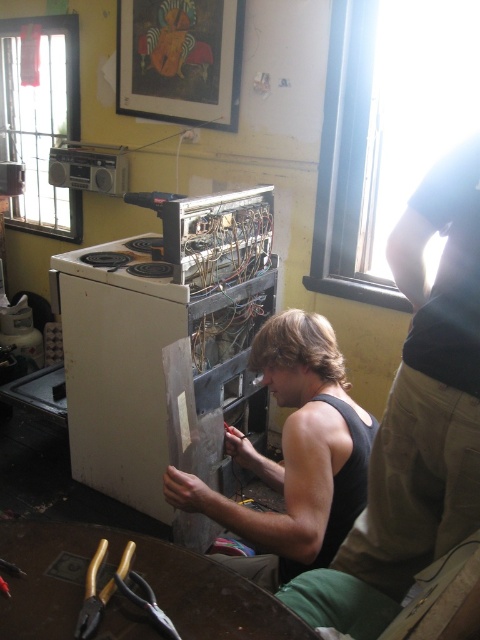
Question: Among these points, which one is nearest to the camera?

Choices:
 (A) (298, 435)
 (B) (90, 588)
 (C) (180, 362)
 (D) (435, 371)

Answer: (B)

Question: Is black tank top at center smaller than gold metallic pliers at lower left?

Choices:
 (A) yes
 (B) no

Answer: (B)

Question: Considering the relative positions of black tank top at center and black matte tank top at center in the image provided, where is black tank top at center located with respect to black matte tank top at center?

Choices:
 (A) right
 (B) left

Answer: (A)

Question: Is black tank top at center in front of black matte tank top at center?

Choices:
 (A) yes
 (B) no

Answer: (A)

Question: Among these points, which one is farthest from the camera?

Choices:
 (A) (335, 595)
 (B) (135, 451)
 (C) (85, 596)

Answer: (B)

Question: Which of the following is the closest to the observer?

Choices:
 (A) (431, 180)
 (B) (93, 602)

Answer: (B)